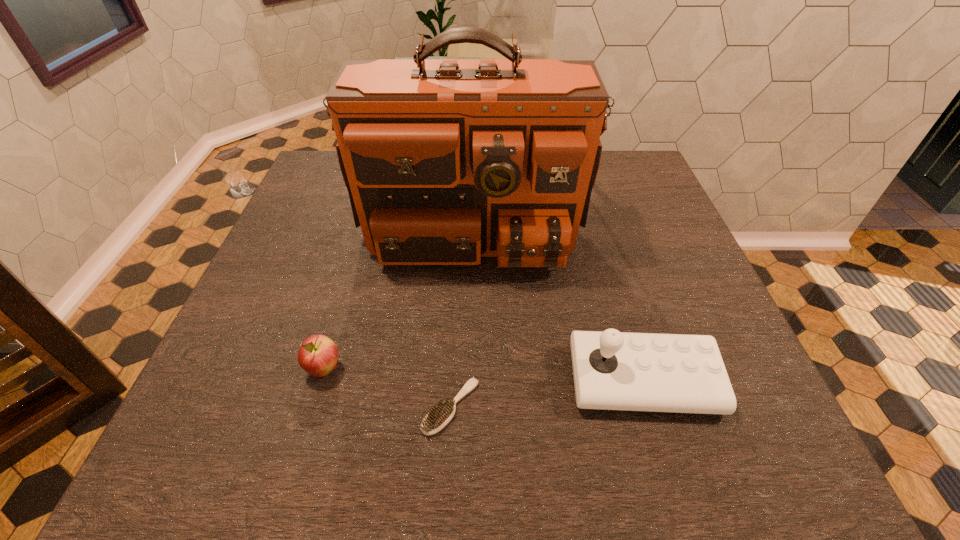
I want to click on vacant region between the second tallest object and the satchel, so click(558, 293).

At what (x,y) coordinates should I click in order to perform the action: click on vacant space that's between the second shortest object and the scrubbing brush. Please return your answer as a coordinate pair (x, y). The height and width of the screenshot is (540, 960). Looking at the image, I should click on (388, 388).

Identify the location of vacant space that's between the third shortest object and the third tallest object. The image size is (960, 540). click(484, 375).

At what (x,y) coordinates should I click in order to perform the action: click on empty location between the second tallest object and the apple. Please return your answer as a coordinate pair (x, y). Image resolution: width=960 pixels, height=540 pixels. Looking at the image, I should click on (484, 375).

Identify the location of free space that is in between the shortest object and the apple. tap(388, 388).

Point out which object is positioned as the second nearest to the scrubbing brush. Please provide its 2D coordinates. Your answer should be formatted as a tuple, i.e. [(x, y)], where the tuple contains the x and y coordinates of a point satisfying the conditions above.

[(612, 370)]

The image size is (960, 540). I want to click on object that stands as the third closest to the apple, so click(612, 370).

Identify the location of blank space that satisfies the following two spatial constraints: 1. on the front side of the joystick; 2. on the left side of the second shortest object. This screenshot has width=960, height=540. (322, 381).

The width and height of the screenshot is (960, 540). What are the coordinates of `vacant area in the image that satisfies the following two spatial constraints: 1. on the face side of the satchel; 2. on the left side of the third shortest object` in the screenshot? It's located at (468, 381).

This screenshot has width=960, height=540. Identify the location of free space in the image that satisfies the following two spatial constraints: 1. on the back side of the joystick; 2. on the left side of the shortest object. (452, 381).